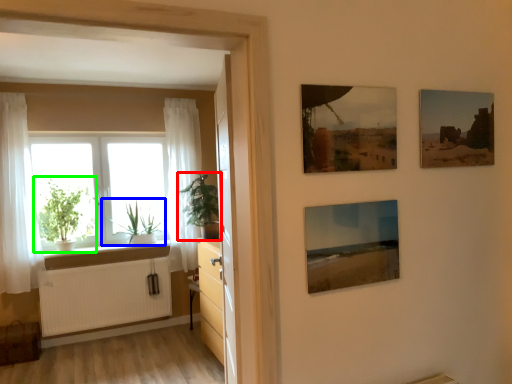
Question: Which object is positioned closest to houseplant (highlighted by a red box)? Select from plant (highlighted by a blue box) and houseplant (highlighted by a green box).

Choices:
 (A) plant
 (B) houseplant

Answer: (A)